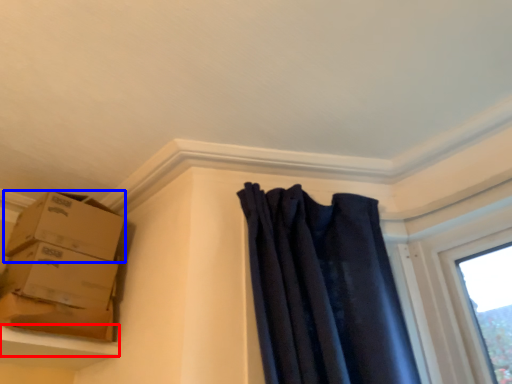
Question: Which point is closer to the camera, window sill (highlighted by a red box) or box (highlighted by a blue box)?

Choices:
 (A) window sill
 (B) box

Answer: (A)